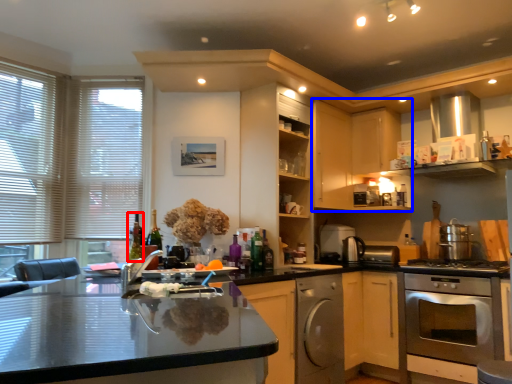
Question: Which of the following is the farthest to the observer, wine bottle (highlighted by a red box) or cabinetry (highlighted by a blue box)?

Choices:
 (A) wine bottle
 (B) cabinetry

Answer: (B)